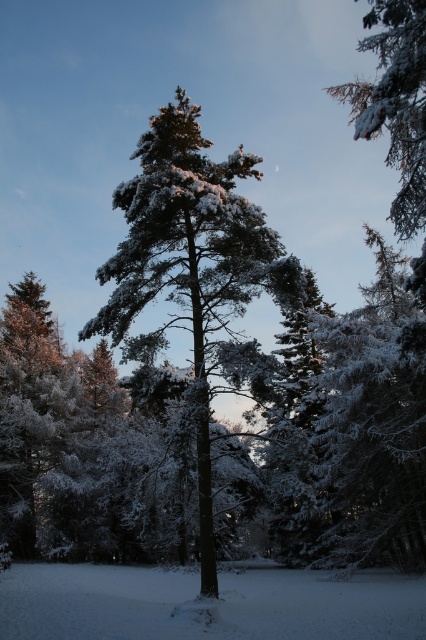
Question: Which point appears farthest from the camera in this image?

Choices:
 (A) click(x=164, y=205)
 (B) click(x=118, y=634)

Answer: (A)

Question: Is snow-covered pine tree at center bigger than slightly frosted pine branch at upper right?

Choices:
 (A) no
 (B) yes

Answer: (A)

Question: Estimate the real-world distances between objects in this image. Which object is closer to the white fluffy snow at center?

Choices:
 (A) slightly frosted pine branch at upper right
 (B) snow-covered pine tree at center

Answer: (B)

Question: Does snow-covered pine tree at center have a smaller size compared to white fluffy snow at center?

Choices:
 (A) no
 (B) yes

Answer: (B)

Question: Which object is farther from the camera taking this photo?

Choices:
 (A) white fluffy snow at center
 (B) slightly frosted pine branch at upper right

Answer: (B)

Question: Is snow-covered pine tree at center bigger than white fluffy snow at center?

Choices:
 (A) no
 (B) yes

Answer: (A)